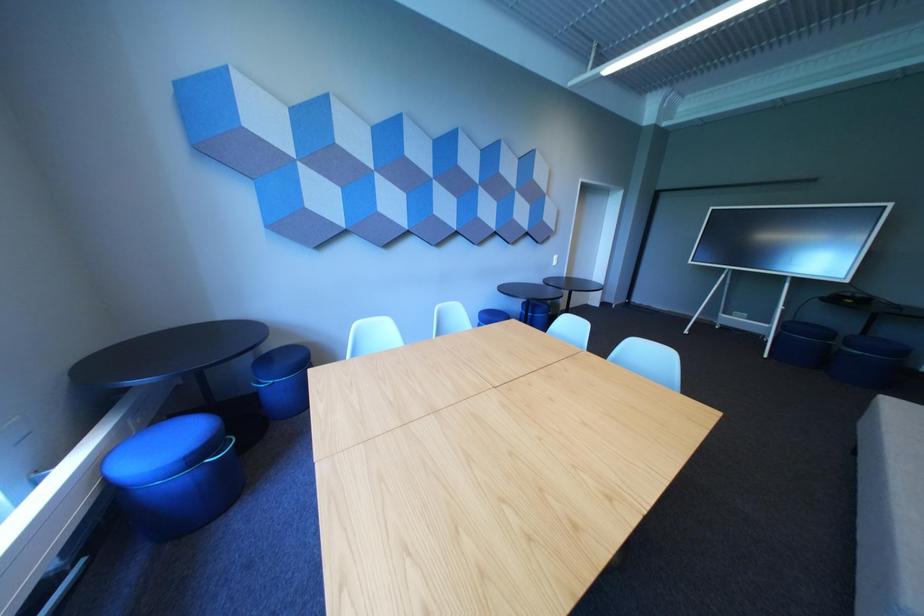
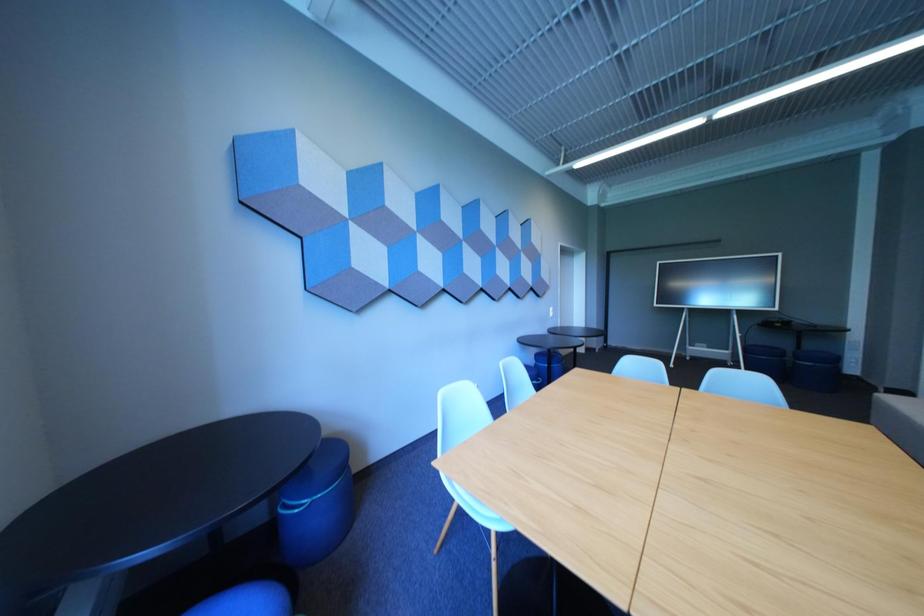
Question: Based on the continuous images, in which direction is the camera rotating? Reply with the corresponding letter.

Choices:
 (A) Left
 (B) Right
 (C) Up
 (D) Down

Answer: (C)